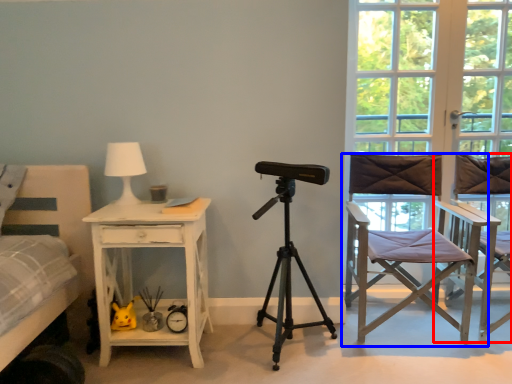
Question: Which point is closer to the camera, chair (highlighted by a red box) or chair (highlighted by a blue box)?

Choices:
 (A) chair
 (B) chair

Answer: (A)